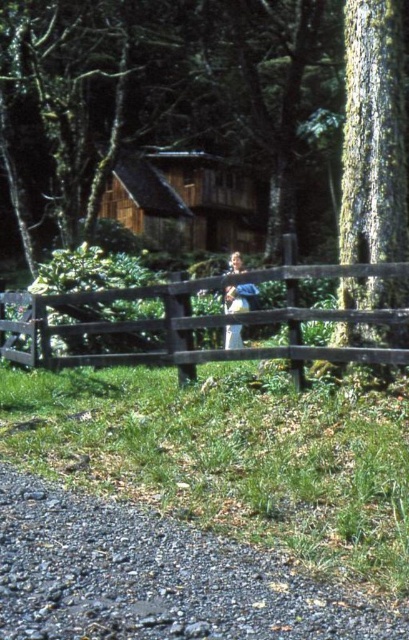
Question: Can you confirm if gravelly stone path at lower left is positioned to the left of light blue denim jeans at center?

Choices:
 (A) yes
 (B) no

Answer: (A)

Question: Is smooth bark tree at center thinner than light blue denim jeans at center?

Choices:
 (A) yes
 (B) no

Answer: (B)

Question: Which of the following is the farthest from the observer?

Choices:
 (A) smooth bark tree at center
 (B) brown wooden fence at center

Answer: (B)

Question: Which of these objects is positioned farthest from the smooth bark tree at center?

Choices:
 (A) light blue denim jeans at center
 (B) brown wooden fence at center
 (C) smooth bark tree at center right

Answer: (A)

Question: From the image, what is the correct spatial relationship of gravelly stone path at lower left in relation to light blue denim jeans at center?

Choices:
 (A) right
 (B) left

Answer: (B)

Question: Which object is positioned farthest from the smooth bark tree at center?

Choices:
 (A) smooth bark tree at center right
 (B) gravelly stone path at lower left
 (C) brown wooden fence at center
 (D) light blue denim jeans at center

Answer: (B)